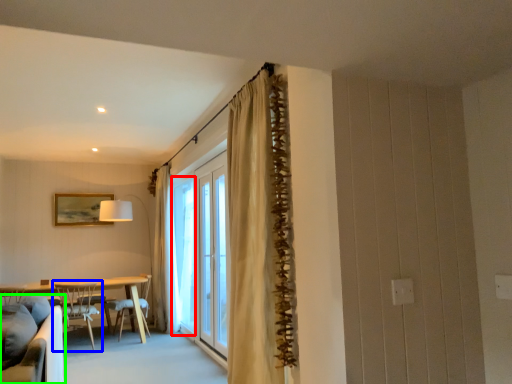
Question: Which object is positioned closest to window (highlighted by a red box)? Select from chair (highlighted by a blue box) and studio couch (highlighted by a green box).

Choices:
 (A) chair
 (B) studio couch

Answer: (A)